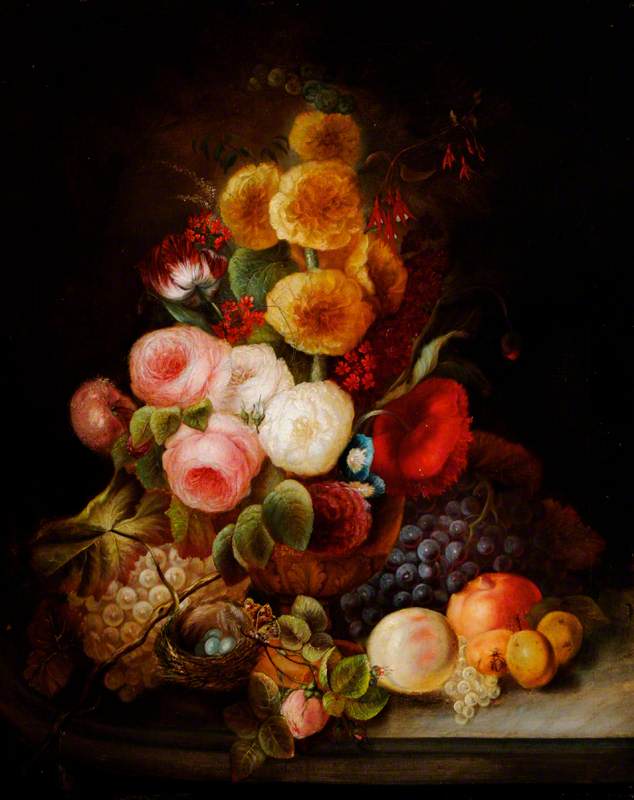
Identify the location of pink flowers. (305, 718), (198, 456), (99, 408), (164, 373).